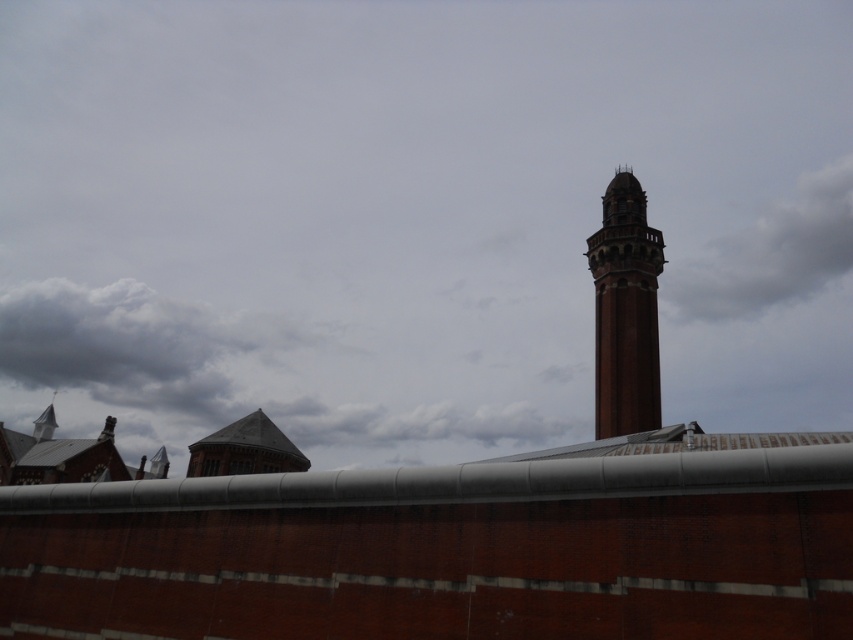
Does gray fluffy cloud at lower left have a larger size compared to brick tower at right?

Yes.

Is gray fluffy cloud at lower left in front of brick tower at right?

No, gray fluffy cloud at lower left is further to the viewer.

Identify the location of gray fluffy cloud at lower left. The height and width of the screenshot is (640, 853). (136, 344).

Is gray fluffy cloud at upper right positioned before brick tower at right?

No, gray fluffy cloud at upper right is behind brick tower at right.

Is point (839, 260) positioned in front of point (613, 433)?

No, it is behind (613, 433).

The width and height of the screenshot is (853, 640). What are the coordinates of `gray fluffy cloud at upper right` in the screenshot? It's located at (770, 252).

Who is higher up, gray fluffy cloud at lower left or gray fluffy cloud at upper right?

Positioned higher is gray fluffy cloud at upper right.

Is gray fluffy cloud at lower left further to the viewer compared to gray fluffy cloud at upper right?

Yes, it is.

Who is more distant from viewer, (35, 380) or (735, 248)?

Positioned behind is point (35, 380).

The width and height of the screenshot is (853, 640). Identify the location of gray fluffy cloud at lower left. (136, 344).